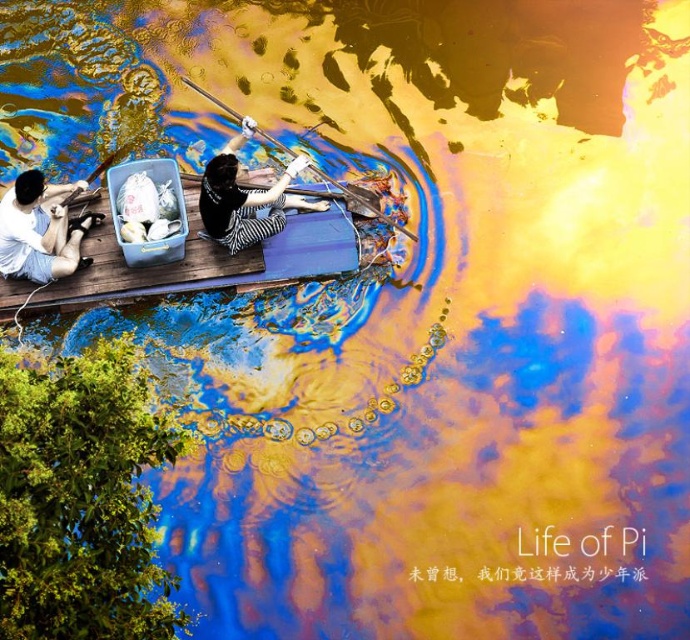
Is point (12, 269) less distant than point (210, 177)?

That is False.

Is light blue denim shorts at lower left bigger than striped fabric woman at center?

No, light blue denim shorts at lower left is not bigger than striped fabric woman at center.

Locate an element on the screen. light blue denim shorts at lower left is located at coordinates (39, 228).

Is matte black boat at center to the left of wooden paddle at center from the viewer's perspective?

Indeed, matte black boat at center is positioned on the left side of wooden paddle at center.

Which is in front, point (299, 208) or point (319, 170)?

Point (299, 208)

Where is `matte black boat at center`? The image size is (690, 640). matte black boat at center is located at coordinates (39, 234).

How distant is matte black boat at center from striped fabric woman at center?

matte black boat at center and striped fabric woman at center are 1.75 meters apart.

Is matte black boat at center positioned in front of striped fabric woman at center?

Yes, matte black boat at center is closer to the viewer.

Who is more distant from viewer, (201, 212) or (286, 177)?

The point (286, 177) is behind.

This screenshot has width=690, height=640. Find the location of `matte black boat at center`. matte black boat at center is located at coordinates (x=39, y=234).